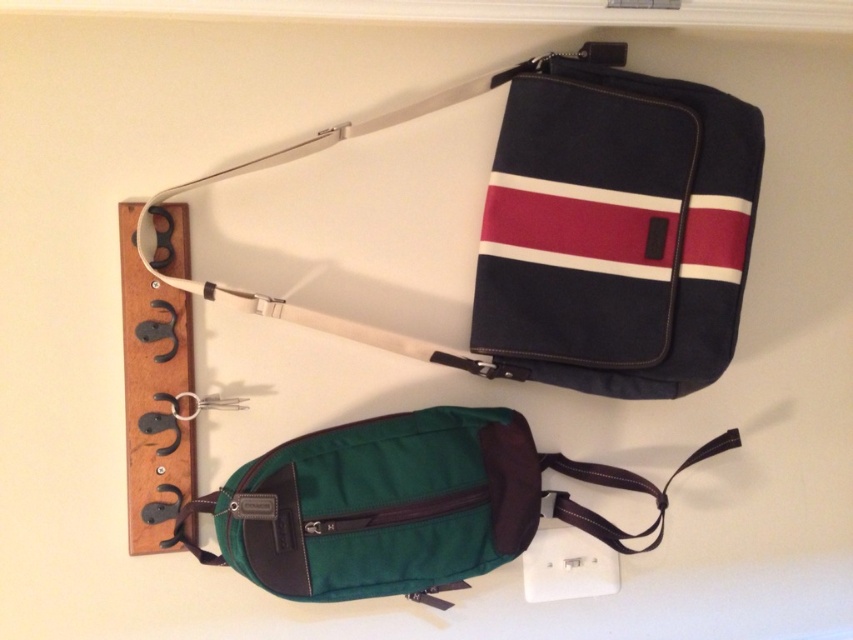
Question: Is navy canvas shoulder bag at upper right in front of green fabric pouch at lower center?

Choices:
 (A) yes
 (B) no

Answer: (B)

Question: Does navy canvas shoulder bag at upper right appear under green fabric pouch at lower center?

Choices:
 (A) no
 (B) yes

Answer: (A)

Question: Which point appears farthest from the camera in this image?

Choices:
 (A) click(746, 115)
 (B) click(486, 451)

Answer: (B)

Question: Which of the following is the closest to the observer?

Choices:
 (A) (553, 243)
 (B) (483, 561)

Answer: (B)

Question: Does navy canvas shoulder bag at upper right have a smaller size compared to green fabric pouch at lower center?

Choices:
 (A) yes
 (B) no

Answer: (B)